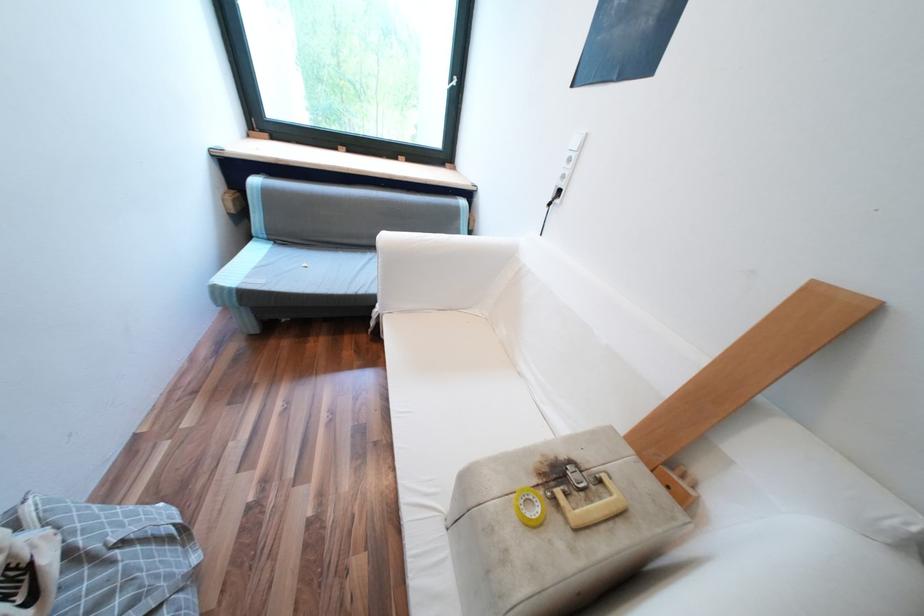
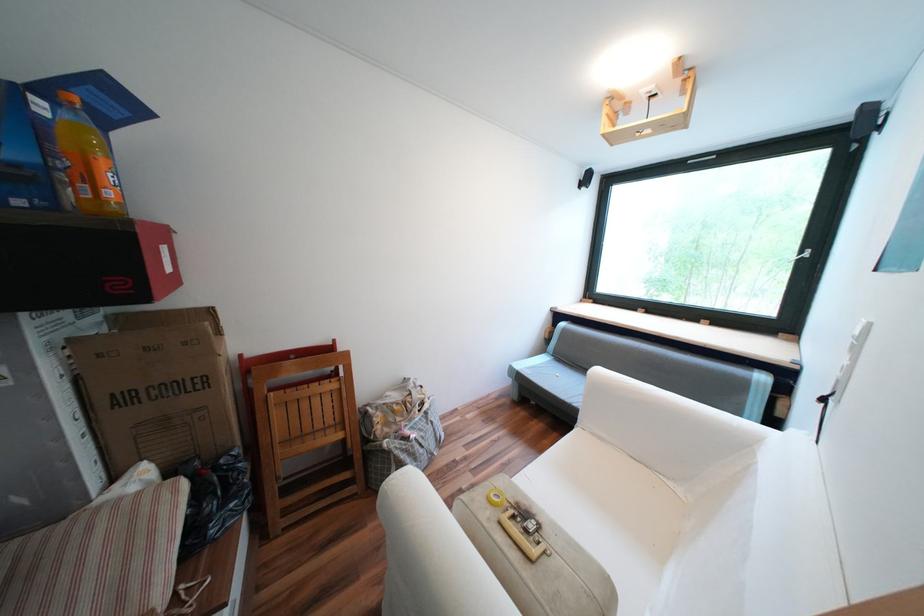
Find the pixel in the second image that matches [226,290] in the first image.

(520, 369)